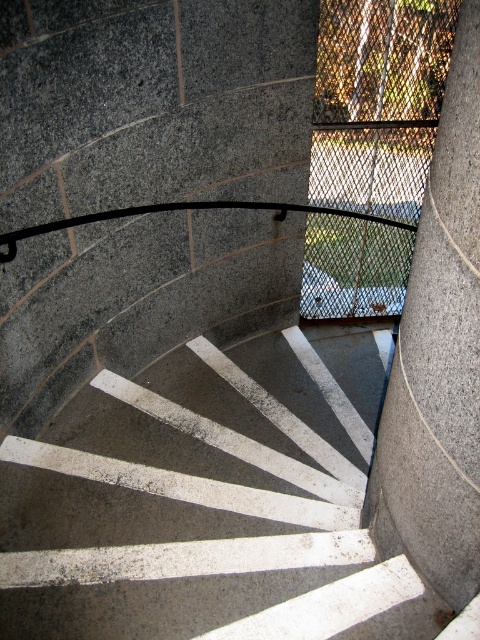
Question: Which point is farther to the camera?

Choices:
 (A) gray granite pillar at center
 (B) concrete stairs at center

Answer: (B)

Question: Is concrete stairs at center positioned behind gray granite pillar at center?

Choices:
 (A) yes
 (B) no

Answer: (A)

Question: Among these points, which one is nearest to the camera?

Choices:
 (A) (458, 480)
 (B) (357, 394)

Answer: (A)

Question: Considering the relative positions of concrete stairs at center and gray granite pillar at center in the image provided, where is concrete stairs at center located with respect to gray granite pillar at center?

Choices:
 (A) below
 (B) above

Answer: (A)

Question: Can you confirm if concrete stairs at center is positioned below gray granite pillar at center?

Choices:
 (A) no
 (B) yes

Answer: (B)